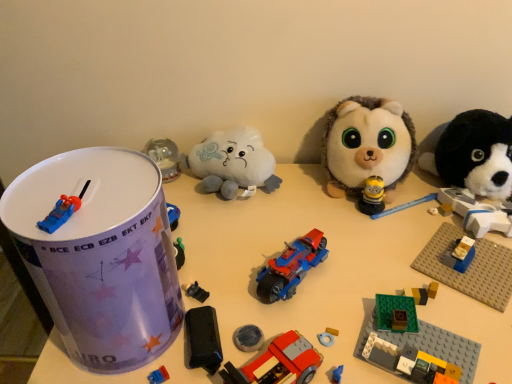
The width and height of the screenshot is (512, 384). Find the location of `free space between shiny plastic motorcycle at center, the 4th toy viewed from the right, and fluffy white plush at center, the 2th toy viewed from the right`. free space between shiny plastic motorcycle at center, the 4th toy viewed from the right, and fluffy white plush at center, the 2th toy viewed from the right is located at coordinates (332, 230).